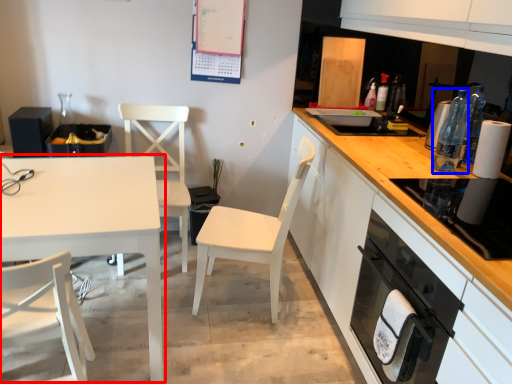
Question: Which point is closer to the camera, table (highlighted by a red box) or bottle (highlighted by a blue box)?

Choices:
 (A) table
 (B) bottle

Answer: (A)